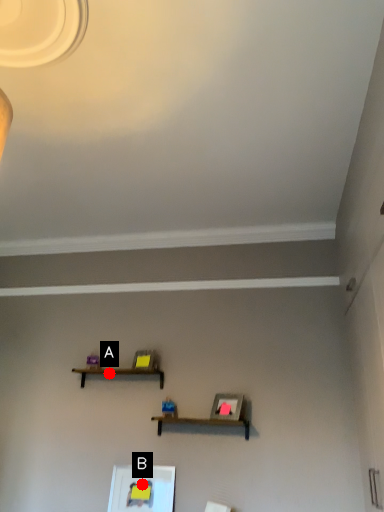
Question: Two points are circled on the image, labeled by A and B beside each circle. Which point appears closest to the camera in this image?

Choices:
 (A) A is closer
 (B) B is closer

Answer: (B)